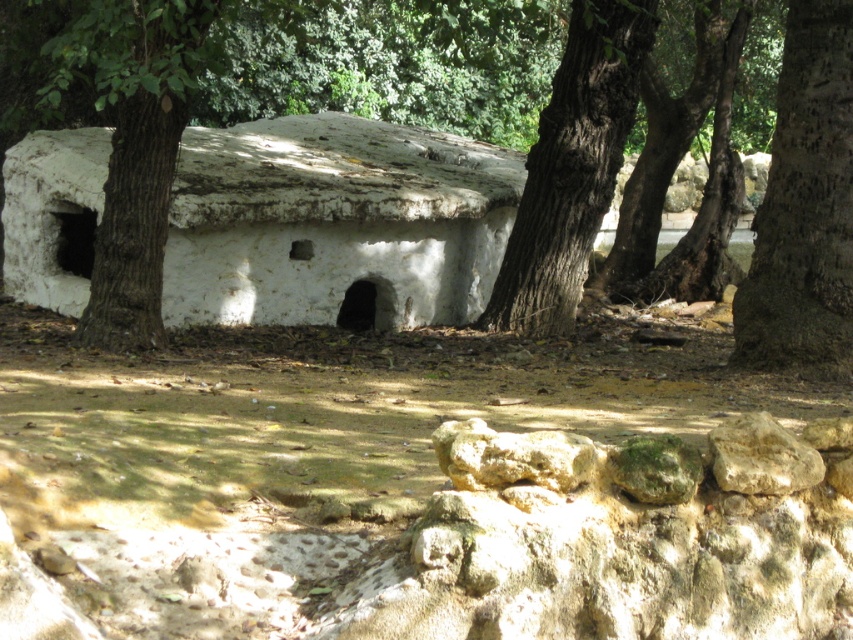
Based on the photo, you are a hiker who has just arrived at this rustic structure. You need to place a 5 meter long wooden beam between the brown rough tree at center and the smooth beige rock at lower right. Can you fit it there without bending the beam?

The distance between the brown rough tree at center and the smooth beige rock at lower right is 5.32 meters. Since the beam is 5 meters long, it can fit between them as the distance is slightly longer than the beam.

You are a hiker who needs to decide between using the brown rough tree at center or the smooth beige rock at lower right to mark a trail. Which object would you choose if you want the marker to be more noticeable from a distance?

The smooth beige rock at lower right would be more noticeable from a distance because it occupies more space than the brown rough tree at center.